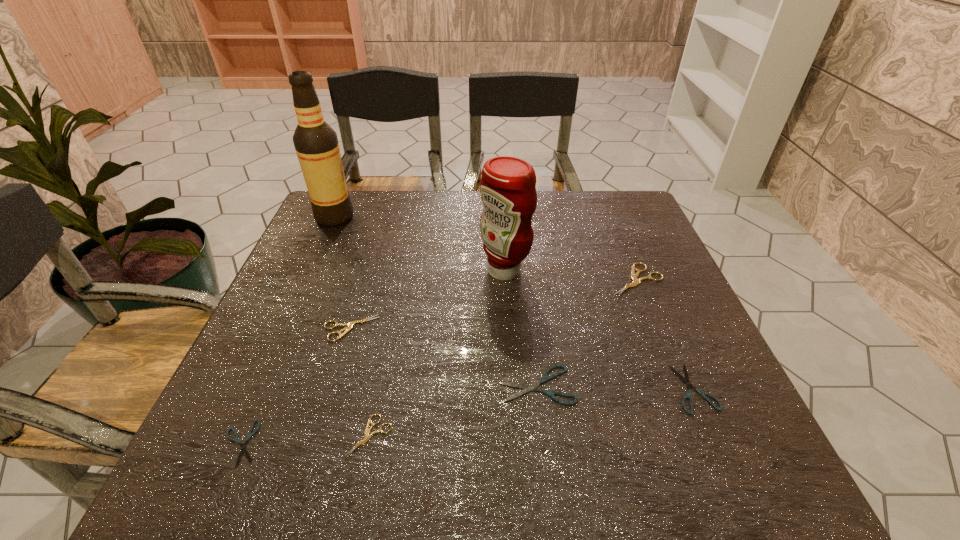
Find the location of `vacant space that satisfies the following two spatial constraints: 1. on the label of the rightmost beige shears; 2. on the right side of the beige alcohol`. vacant space that satisfies the following two spatial constraints: 1. on the label of the rightmost beige shears; 2. on the right side of the beige alcohol is located at coordinates (306, 280).

Locate an element on the screen. This screenshot has width=960, height=540. free space that satisfies the following two spatial constraints: 1. on the label of the alcohol; 2. on the right side of the condiment is located at coordinates (310, 271).